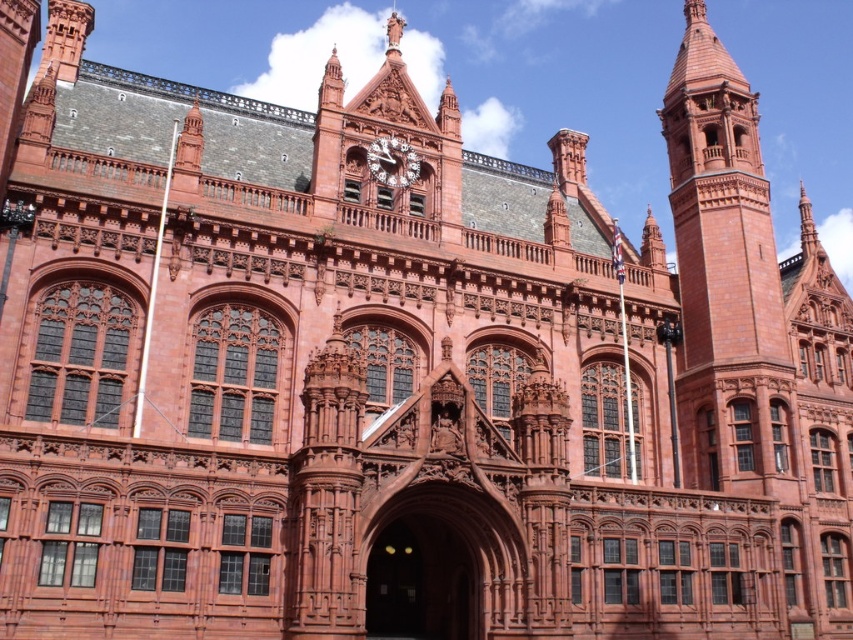
You are an architect examining the building entrance. You need to install a new security camera. The camera must be placed above the smooth stone archway at center but below the polished brass clock at center. Is this possible based on the current arrangement?

Yes, the smooth stone archway at center is positioned under the polished brass clock at center, so there is space between them to place the camera above the archway and below the clock.

You are standing in front of the grand Victorian Gothic building and notice two points marked on its facade. The first point is located at coordinates point (415, 520), and the second is at point (413, 176). Which of these two points is closer to your current position?

Point (415, 520) is closer to the camera than point (413, 176). Therefore, the point at coordinates point (415, 520) is closer to your current position.